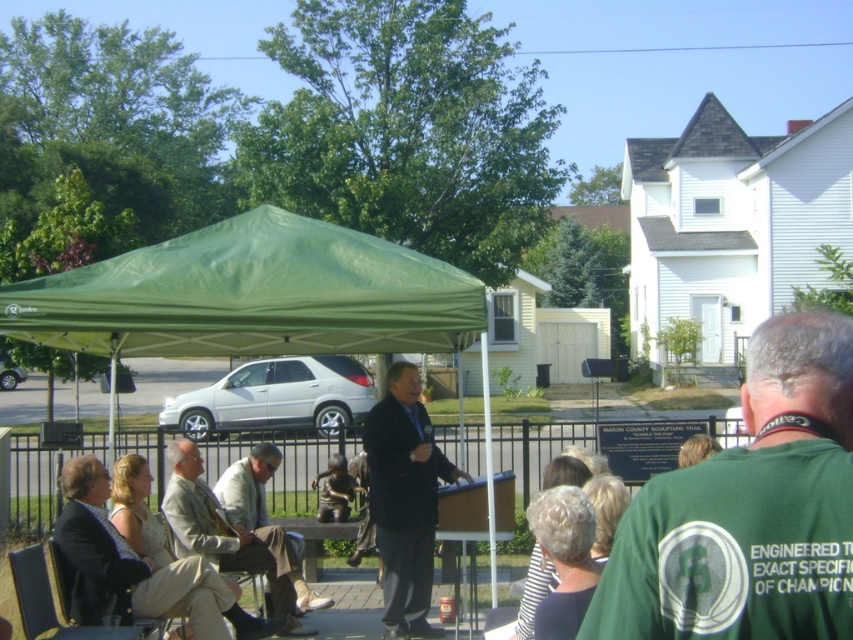
Question: Which of the following is the closest to the observer?

Choices:
 (A) (270, 554)
 (B) (248, 488)
 (C) (680, 500)
 (D) (189, 248)

Answer: (C)

Question: Does green fabric shirt at center appear over light beige fabric pants at center?

Choices:
 (A) yes
 (B) no

Answer: (A)

Question: Does green fabric shirt at center have a larger size compared to green fabric tent at center?

Choices:
 (A) yes
 (B) no

Answer: (A)

Question: Which of the following is the closest to the observer?

Choices:
 (A) (265, 448)
 (B) (143, 312)

Answer: (B)

Question: Which point is farther from the camera taking this photo?

Choices:
 (A) [x=689, y=556]
 (B) [x=256, y=296]
 (C) [x=222, y=529]

Answer: (C)

Question: Is green fabric canopy at center further to camera compared to dark blue suit at center?

Choices:
 (A) no
 (B) yes

Answer: (A)